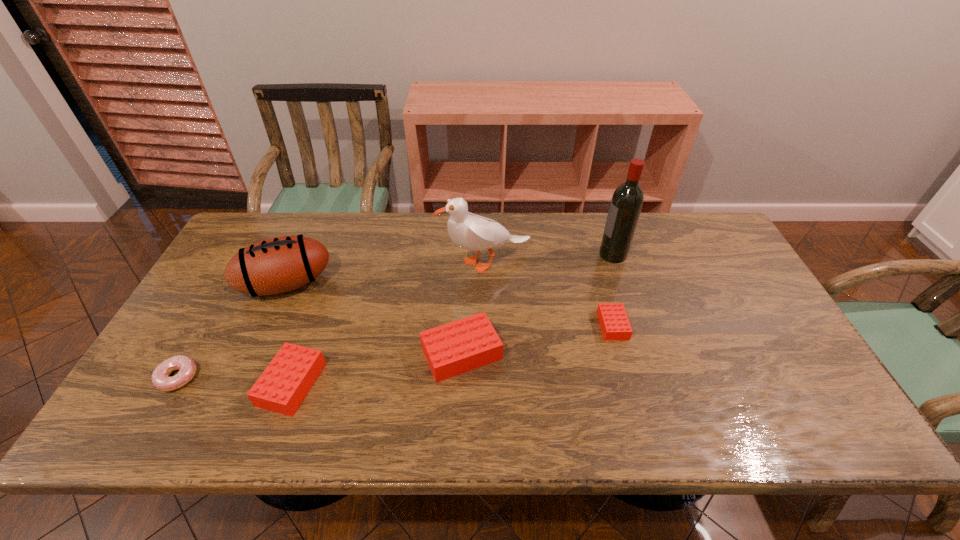
Locate an element on the screen. The height and width of the screenshot is (540, 960). free space in the image that satisfies the following two spatial constraints: 1. on the front side of the leftmost Lego; 2. on the left side of the football (American) is located at coordinates (242, 384).

Locate an element on the screen. This screenshot has height=540, width=960. vacant space that satisfies the following two spatial constraints: 1. on the front side of the football (American); 2. on the left side of the second Lego from right to left is located at coordinates (255, 353).

This screenshot has width=960, height=540. I want to click on vacant region that satisfies the following two spatial constraints: 1. on the back side of the football (American); 2. on the right side of the doughnut, so click(x=231, y=284).